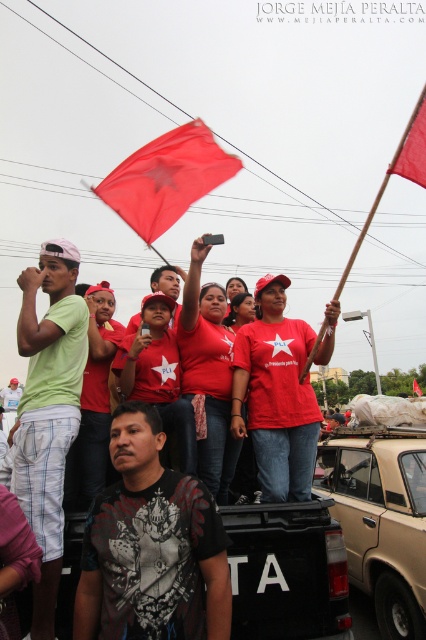
Is dark gray printed shirt at center further to the viewer compared to red fabric flag at upper right?

No, it is not.

Can you confirm if dark gray printed shirt at center is positioned above red fabric flag at upper right?

No.

Locate an element on the screen. The width and height of the screenshot is (426, 640). dark gray printed shirt at center is located at coordinates (150, 547).

Is point (221, 170) behind point (406, 128)?

Yes.

The image size is (426, 640). In order to click on red matte flag at upper center in this screenshot , I will do `click(166, 179)`.

Is point (193, 186) more distant than point (417, 122)?

Yes.

Image resolution: width=426 pixels, height=640 pixels. I want to click on red matte flag at upper center, so click(x=166, y=179).

Measure the distance between red matte shirt at center and camera.

4.46 meters

You are a GUI agent. You are given a task and a screenshot of the screen. Output one action in this format:
    pyautogui.click(x=<x>, y=<y>)
    Task: Click on the red matte shirt at center
    Image resolution: width=426 pixels, height=640 pixels.
    Given the screenshot: What is the action you would take?
    pyautogui.click(x=276, y=396)